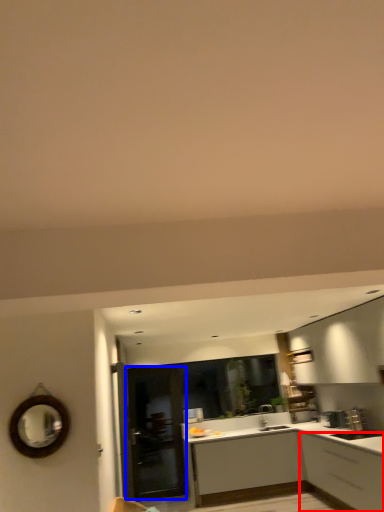
Question: Which object is closer to the camera taking this photo, cabinetry (highlighted by a red box) or glass door (highlighted by a blue box)?

Choices:
 (A) cabinetry
 (B) glass door

Answer: (A)